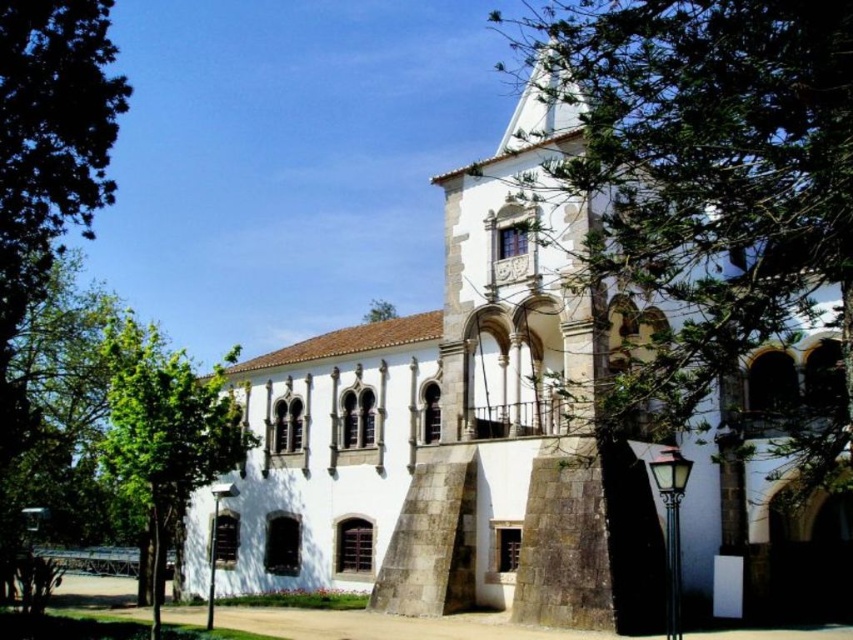
Is point (683, 60) positioned after point (386, 300)?

No, it is in front of (386, 300).

Who is shorter, green leafy tree at upper right or green leafy tree at upper center?

With less height is green leafy tree at upper center.

This screenshot has width=853, height=640. In order to click on green leafy tree at upper right in this screenshot , I will do `click(709, 177)`.

Can you confirm if green leafy tree at upper right is wider than green leafy tree at left?

No, green leafy tree at upper right is not wider than green leafy tree at left.

The height and width of the screenshot is (640, 853). What do you see at coordinates (709, 177) in the screenshot?
I see `green leafy tree at upper right` at bounding box center [709, 177].

Image resolution: width=853 pixels, height=640 pixels. What do you see at coordinates (709, 177) in the screenshot? I see `green leafy tree at upper right` at bounding box center [709, 177].

Find the location of a particular element. This screenshot has width=853, height=640. green leafy tree at upper right is located at coordinates (709, 177).

Can you confirm if green leafy tree at center is wider than green leafy tree at upper center?

Answer: Yes.

This screenshot has width=853, height=640. What do you see at coordinates (165, 435) in the screenshot? I see `green leafy tree at center` at bounding box center [165, 435].

This screenshot has width=853, height=640. In order to click on green leafy tree at center in this screenshot , I will do `click(165, 435)`.